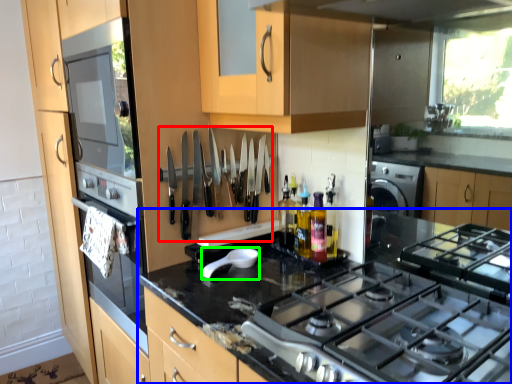
Question: Based on their relative distances, which object is nearer to cutlery (highlighted by a red box)? Choose from countertop (highlighted by a blue box) and appliance (highlighted by a green box).

Choices:
 (A) countertop
 (B) appliance

Answer: (B)